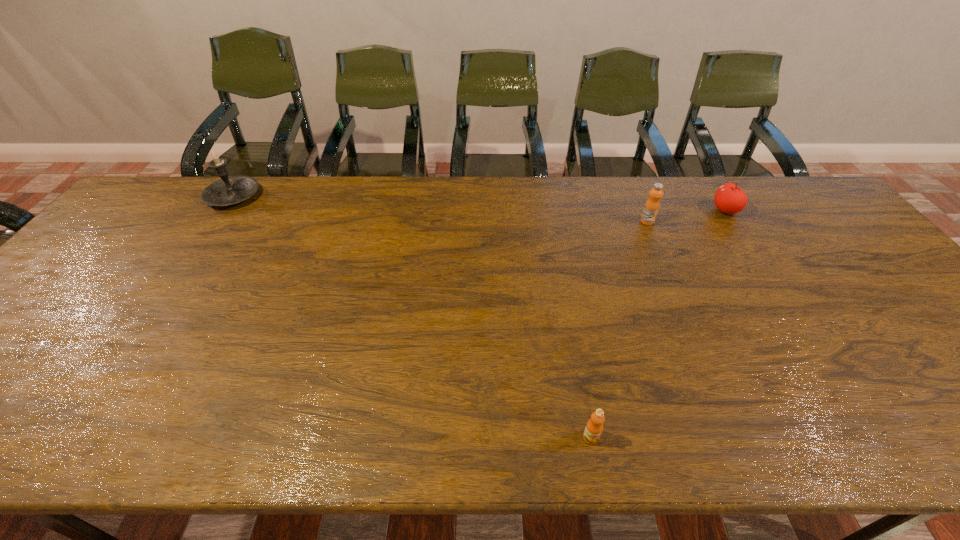
Find the location of `free space that is in between the rightmost object and the taller orange juice`. free space that is in between the rightmost object and the taller orange juice is located at coordinates (686, 216).

This screenshot has height=540, width=960. Find the location of `free space between the leftmost object and the farther orange juice`. free space between the leftmost object and the farther orange juice is located at coordinates (441, 209).

The image size is (960, 540). I want to click on free space between the left orange juice and the third object from left to right, so click(x=619, y=329).

Locate an element on the screen. vacant area between the third shortest object and the third object from right to left is located at coordinates (619, 329).

Where is `free area in between the leftmost object and the shorter orange juice`? Image resolution: width=960 pixels, height=540 pixels. free area in between the leftmost object and the shorter orange juice is located at coordinates (412, 317).

The height and width of the screenshot is (540, 960). Find the location of `unoccupied area between the shorter orange juice and the apple`. unoccupied area between the shorter orange juice and the apple is located at coordinates (658, 324).

The width and height of the screenshot is (960, 540). Identify the location of vacant point located between the rightmost object and the nearer orange juice. (658, 324).

The image size is (960, 540). Find the location of `free space between the third object from right to left and the taller orange juice`. free space between the third object from right to left and the taller orange juice is located at coordinates (619, 329).

At what (x,y) coordinates should I click in order to perform the action: click on object that stands as the closest to the tallest object. Please return your answer as a coordinate pair (x, y). The height and width of the screenshot is (540, 960). Looking at the image, I should click on (594, 427).

Identify which object is located as the third nearest to the leftmost object. Please provide its 2D coordinates. Your answer should be formatted as a tuple, i.e. [(x, y)], where the tuple contains the x and y coordinates of a point satisfying the conditions above.

[(730, 199)]